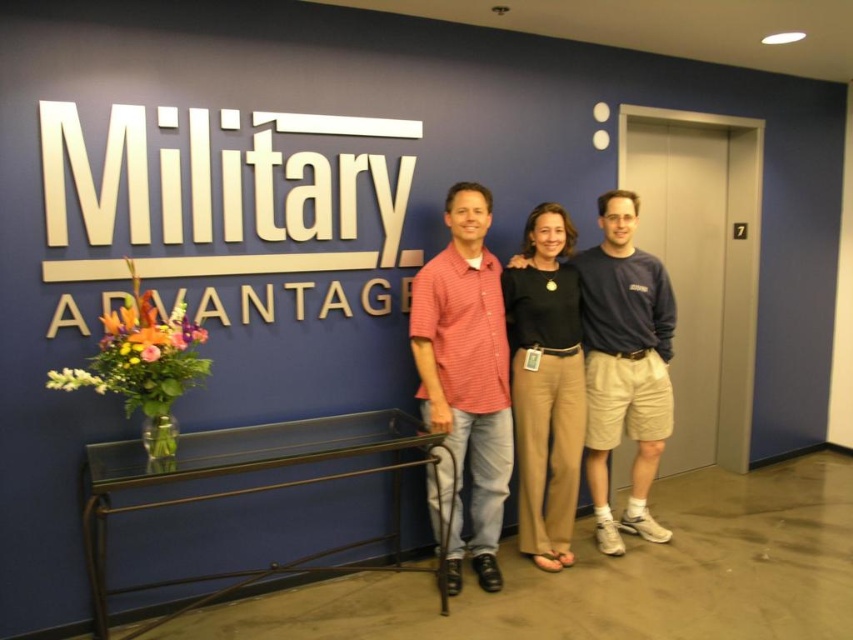
Question: Which point is closer to the camera?

Choices:
 (A) blue cotton shirt at center
 (B) black cotton pants at center

Answer: (B)

Question: Does red checkered shirt at center come behind blue cotton shirt at center?

Choices:
 (A) yes
 (B) no

Answer: (B)

Question: Which point appears farthest from the camera in this image?

Choices:
 (A) (479, 467)
 (B) (561, 548)
 (C) (606, 420)

Answer: (C)

Question: Is red checkered shirt at center thinner than black cotton pants at center?

Choices:
 (A) no
 (B) yes

Answer: (A)

Question: Which point is closer to the camera taking this photo?

Choices:
 (A) (549, 531)
 (B) (480, 333)
 (C) (604, 256)

Answer: (B)

Question: In this image, where is red checkered shirt at center located relative to blue cotton shirt at center?

Choices:
 (A) right
 (B) left

Answer: (B)